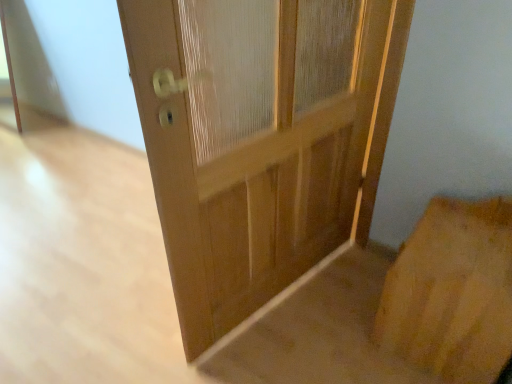
Locate an element on the screen. The height and width of the screenshot is (384, 512). free space between brown cardboard at lower right and natural wood door at center is located at coordinates (324, 334).